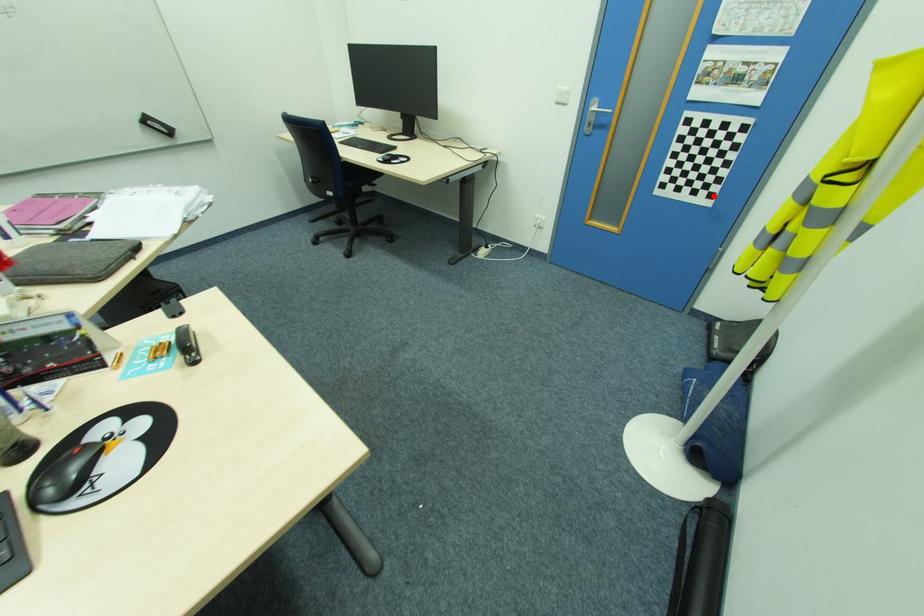
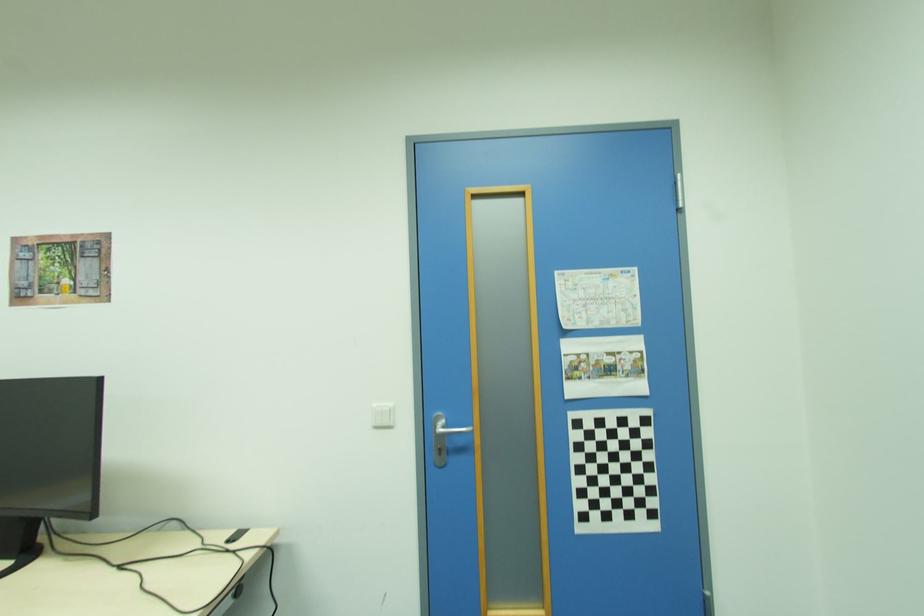
Locate, in the second image, the point that corresponds to the highlighted location in the first image.

(655, 515)